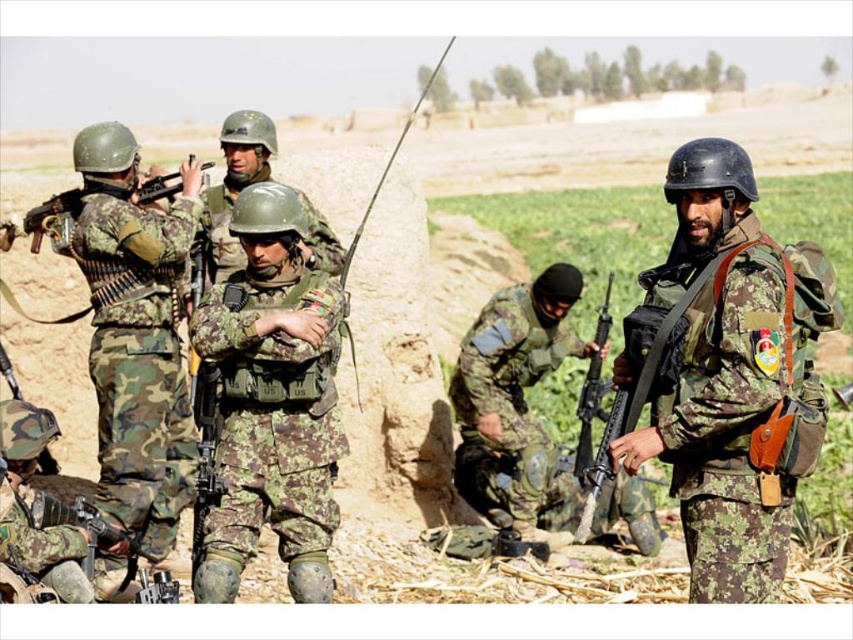
Question: Is camouflage fabric rifle at left behind camouflage fabric uniform at center?

Choices:
 (A) no
 (B) yes

Answer: (B)

Question: Considering the real-world distances, which object is farthest from the camouflage fabric uniform at center?

Choices:
 (A) camouflage fabric uniform at right
 (B) camouflage fabric rifle at left
 (C) matte black rifle at left

Answer: (A)

Question: Which is farther from the camouflage fabric rifle at lower left?

Choices:
 (A) camouflage fabric rifle at center
 (B) camouflage fabric uniform at right

Answer: (A)

Question: Is camouflage fabric uniform at right thinner than camouflage fabric uniform at center?

Choices:
 (A) no
 (B) yes

Answer: (A)

Question: Which point appears farthest from the camera in this image?

Choices:
 (A) (340, 452)
 (B) (99, 292)
 (C) (0, 428)

Answer: (B)

Question: Can you confirm if camouflage fabric rifle at center is positioned to the right of black matte rifle at center?

Choices:
 (A) yes
 (B) no

Answer: (B)